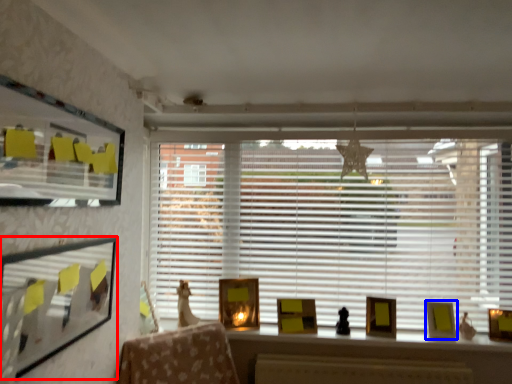
Question: Which object is further to the camera taking this photo, picture frame (highlighted by a red box) or picture frame (highlighted by a blue box)?

Choices:
 (A) picture frame
 (B) picture frame

Answer: (B)